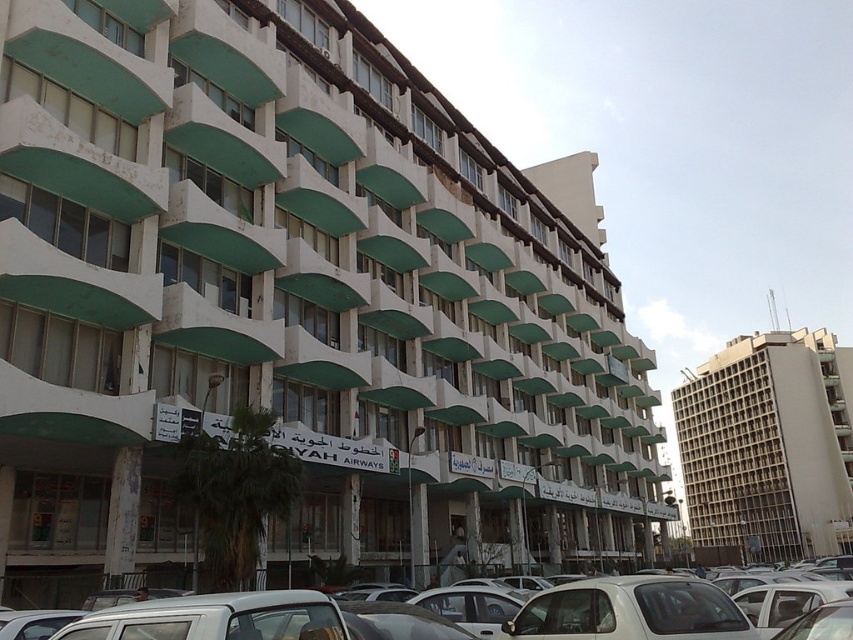
Question: Based on their relative distances, which object is farther from the white matte car at center?

Choices:
 (A) white matte car at lower right
 (B) beige concrete building at right

Answer: (B)

Question: Which of these objects is positioned closest to the white matte car at lower right?

Choices:
 (A) white matte car at center
 (B) beige concrete building at right

Answer: (A)

Question: Is the position of beige concrete building at right more distant than that of white matte car at center?

Choices:
 (A) yes
 (B) no

Answer: (A)

Question: Does white matte car at lower right appear over white matte car at center?

Choices:
 (A) yes
 (B) no

Answer: (A)

Question: Among these points, which one is nearest to the camera?

Choices:
 (A) (746, 352)
 (B) (538, 616)

Answer: (B)

Question: Can you confirm if white matte car at lower right is smaller than white matte car at center?

Choices:
 (A) no
 (B) yes

Answer: (B)